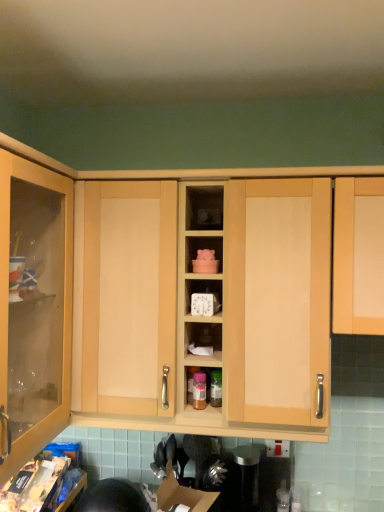
Question: Considering the relative positions of matte wood clock at center and matte wood cabinet at center in the image provided, is matte wood clock at center to the right of matte wood cabinet at center from the viewer's perspective?

Choices:
 (A) yes
 (B) no

Answer: (A)

Question: From a real-world perspective, is matte wood clock at center positioned over matte wood cabinet at center based on gravity?

Choices:
 (A) no
 (B) yes

Answer: (B)

Question: From the image's perspective, is matte wood clock at center below matte wood cabinet at center?

Choices:
 (A) no
 (B) yes

Answer: (A)

Question: Are matte wood clock at center and matte wood cabinet at center beside each other?

Choices:
 (A) yes
 (B) no

Answer: (B)

Question: Is matte wood clock at center aimed at matte wood cabinet at center?

Choices:
 (A) yes
 (B) no

Answer: (A)

Question: Is the position of matte wood clock at center less distant than that of matte wood cabinet at center?

Choices:
 (A) no
 (B) yes

Answer: (A)

Question: Is light wood cabinet at right oriented away from matte wood clock at center?

Choices:
 (A) no
 (B) yes

Answer: (A)

Question: From the image's perspective, would you say light wood cabinet at right is positioned over matte wood clock at center?

Choices:
 (A) no
 (B) yes

Answer: (A)

Question: Does light wood cabinet at right come behind matte wood clock at center?

Choices:
 (A) yes
 (B) no

Answer: (B)

Question: Considering the relative positions of light wood cabinet at right and matte wood clock at center in the image provided, is light wood cabinet at right to the right of matte wood clock at center from the viewer's perspective?

Choices:
 (A) yes
 (B) no

Answer: (A)

Question: Could you tell me if light wood cabinet at right is facing matte wood clock at center?

Choices:
 (A) no
 (B) yes

Answer: (A)

Question: Is light wood cabinet at right at the left side of matte wood clock at center?

Choices:
 (A) yes
 (B) no

Answer: (B)

Question: Could you tell me if satin silver canister at center is turned towards matte wood clock at center?

Choices:
 (A) no
 (B) yes

Answer: (A)